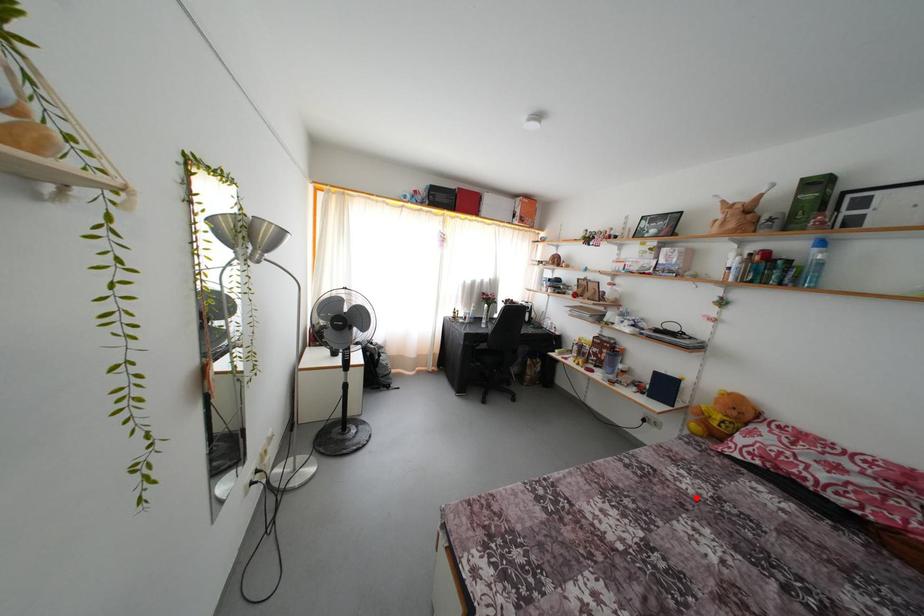
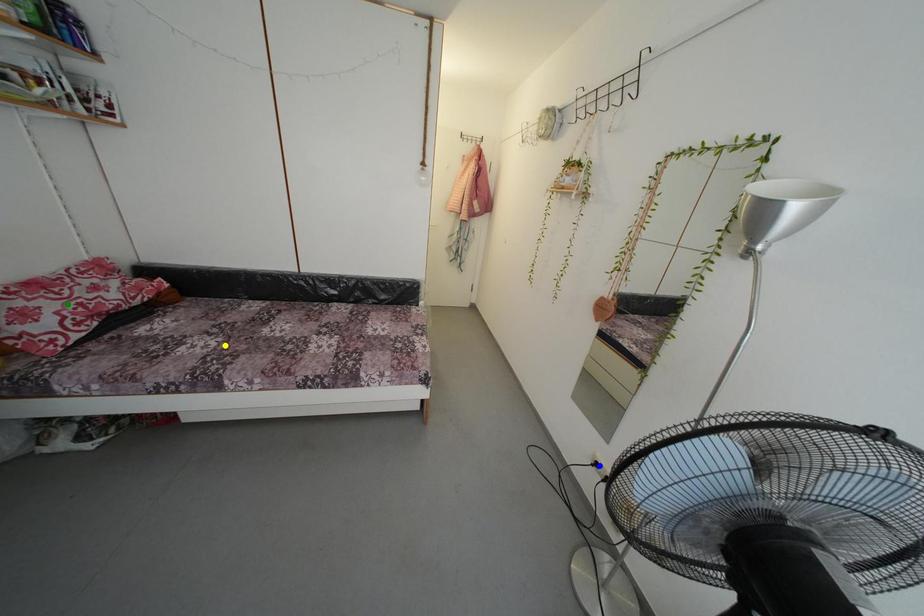
Question: I am providing you with two images of the same scene from different viewpoints. A red point is marked on the first image. You are given multiple points on the second image. Which mark in image 2 goes with the point in image 1?

Choices:
 (A) blue point
 (B) yellow point
 (C) green point

Answer: (B)